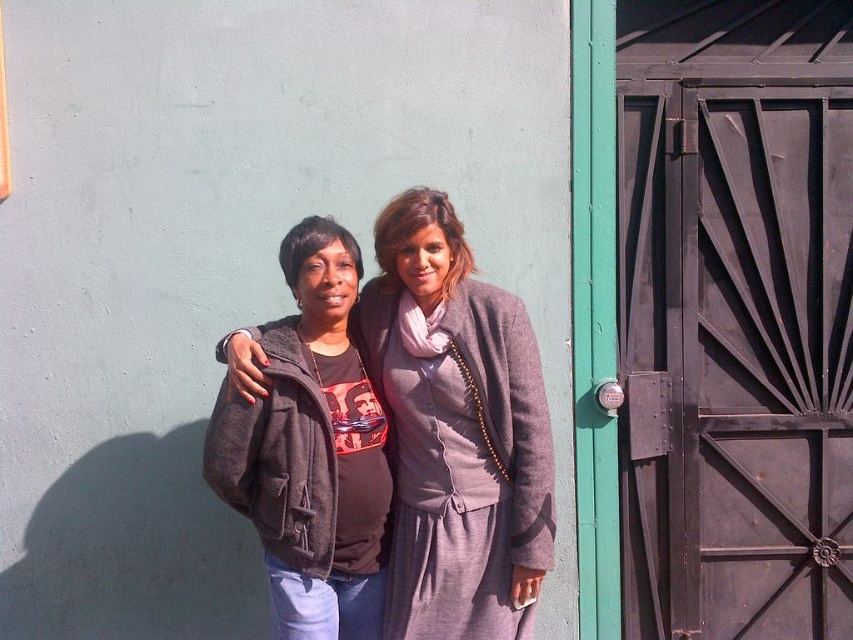
Is matte gray sweater at center positioned at the back of matte brown jacket at center?

That is True.

Is point (508, 374) behind point (376, 536)?

No, (508, 374) is closer to viewer.

You are a GUI agent. You are given a task and a screenshot of the screen. Output one action in this format:
    pyautogui.click(x=<x>, y=<y>)
    Task: Click on the matte gray sweater at center
    The width and height of the screenshot is (853, 640).
    Given the screenshot: What is the action you would take?
    pyautogui.click(x=457, y=432)

Can you confirm if black metal door at right is taller than matte gray sweater at center?

Correct, black metal door at right is much taller as matte gray sweater at center.

Can you confirm if black metal door at right is bigger than matte gray sweater at center?

Indeed, black metal door at right has a larger size compared to matte gray sweater at center.

Which is in front, point (672, 376) or point (463, 611)?

Positioned in front is point (463, 611).

Where is `black metal door at right`? black metal door at right is located at coordinates (735, 356).

Who is higher up, black metal door at right or matte brown jacket at center?

Positioned higher is black metal door at right.

Between black metal door at right and matte brown jacket at center, which one appears on the right side from the viewer's perspective?

black metal door at right

Where is `black metal door at right`? This screenshot has height=640, width=853. black metal door at right is located at coordinates (735, 356).

Locate an element on the screen. Image resolution: width=853 pixels, height=640 pixels. black metal door at right is located at coordinates (735, 356).